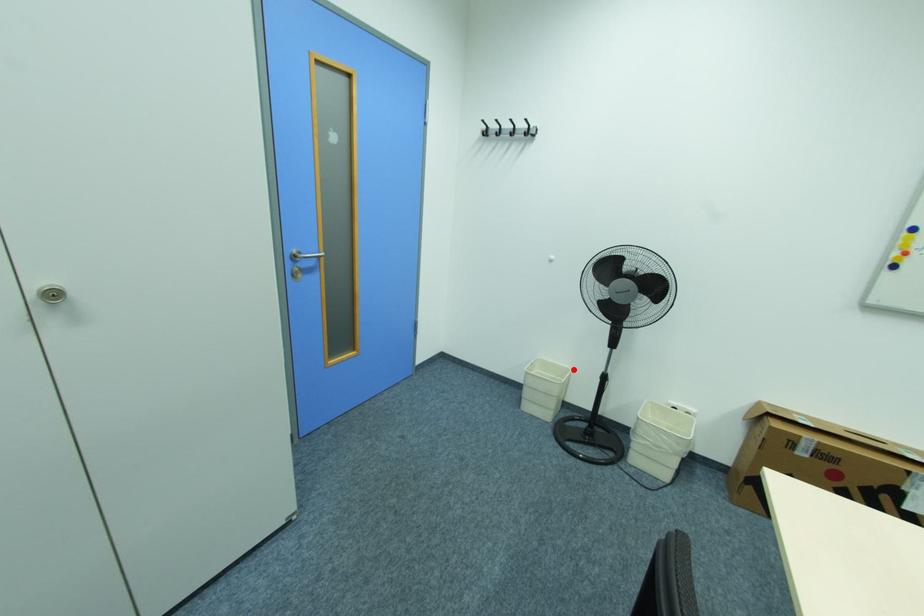
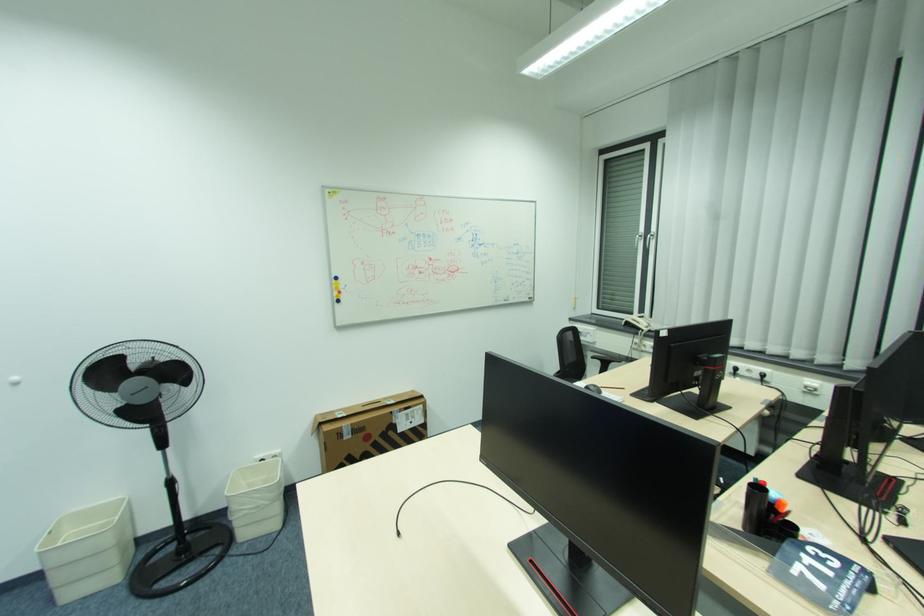
Question: I am providing you with two images of the same scene from different viewpoints. In image1, a red point is highlighted. Considering the same 3D point in image2, which of the following is correct?

Choices:
 (A) It is closer
 (B) It is farther

Answer: (A)